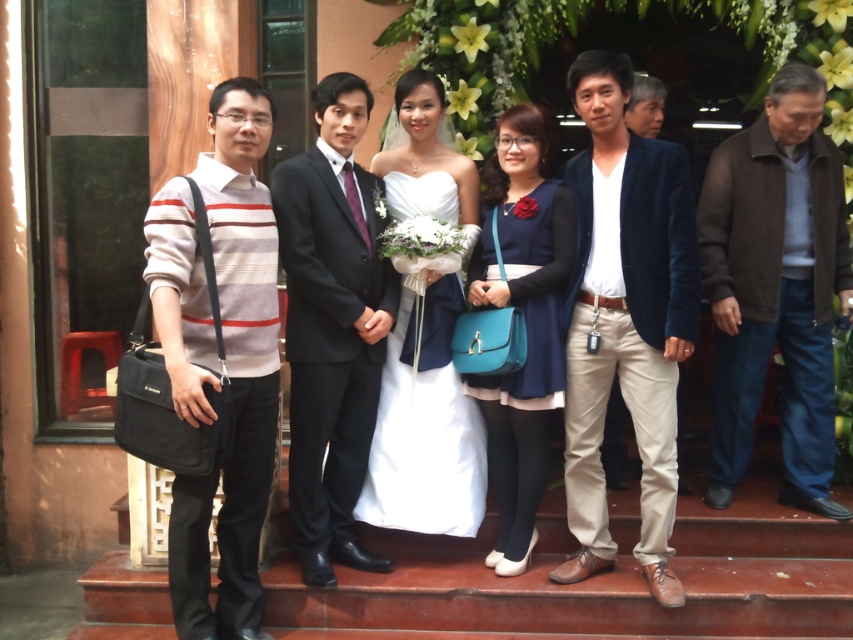
You are standing at the point labeled point (x=706, y=166) and want to take a photo of the people in front of you. Is there any obstruction between you and the point labeled point (x=195, y=284)?

Point (x=706, y=166) is behind point (x=195, y=284), so there is an obstruction between you and the point labeled point (x=195, y=284).

You are a photographer trying to capture a group photo. You need to ensure that the brown woolen jacket at right and the striped sweater at left are at least 2 meters apart to frame them properly. Based on the scene description, can you confirm if they meet this requirement?

The brown woolen jacket at right and striped sweater at left are 2.35 meters apart from each other, which exceeds the required 2 meters, so they meet the framing requirement.